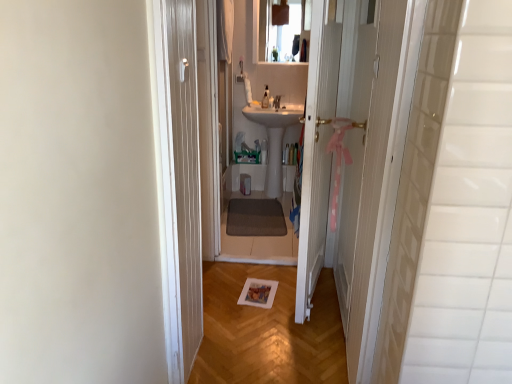
The width and height of the screenshot is (512, 384). In order to click on free space in front of pink ribbon at right in this screenshot , I will do `click(316, 336)`.